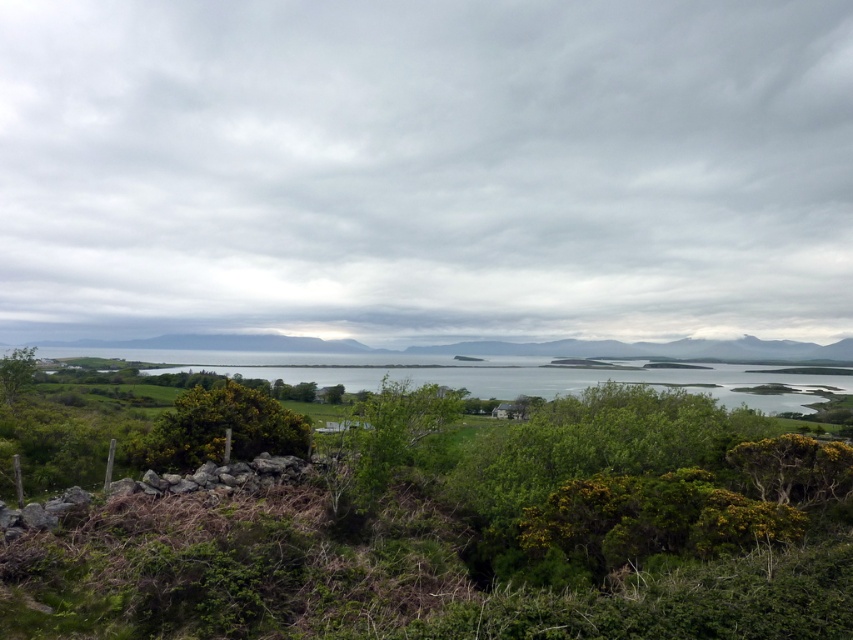
Between green grassy water at center and green leafy bush at center, which one is positioned lower?

green grassy water at center is below.

Does green grassy water at center appear under green leafy bush at center?

Yes.

The height and width of the screenshot is (640, 853). In order to click on green grassy water at center in this screenshot , I will do `click(570, 380)`.

Does green leafy shrubs at center have a lesser width compared to green leafy bush at center?

No, green leafy shrubs at center is not thinner than green leafy bush at center.

Is green leafy shrubs at center smaller than green leafy bush at center?

Actually, green leafy shrubs at center might be larger than green leafy bush at center.

Is point (566, 588) behind point (184, 419)?

No.

I want to click on green leafy shrubs at center, so click(462, 531).

Who is taller, green leafy shrubs at center or green grassy water at center?

green grassy water at center is taller.

Who is more forward, [808,618] or [732,372]?

Point [808,618] is in front.

At what (x,y) coordinates should I click in order to perform the action: click on green leafy shrubs at center. Please return your answer as a coordinate pair (x, y). Looking at the image, I should click on (462, 531).